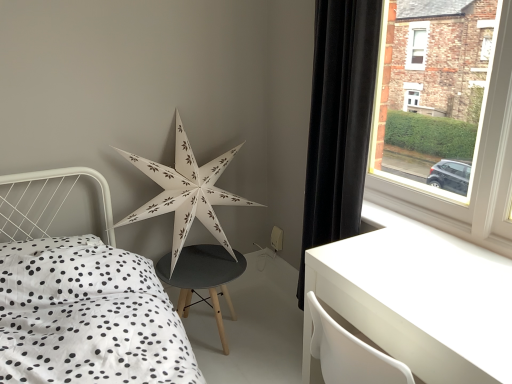
Question: Is black velvet curtain at right bigger than white glossy table at lower right?

Choices:
 (A) no
 (B) yes

Answer: (A)

Question: Are black velvet curtain at right and white glossy table at lower right beside each other?

Choices:
 (A) yes
 (B) no

Answer: (B)

Question: Is black velvet curtain at right oriented towards white glossy table at lower right?

Choices:
 (A) no
 (B) yes

Answer: (A)

Question: From a real-world perspective, is black velvet curtain at right positioned under white glossy table at lower right based on gravity?

Choices:
 (A) no
 (B) yes

Answer: (A)

Question: Is black velvet curtain at right positioned before white glossy table at lower right?

Choices:
 (A) yes
 (B) no

Answer: (B)

Question: Visually, is white glossy table at lower right positioned to the left or to the right of white paper star at center?

Choices:
 (A) left
 (B) right

Answer: (B)

Question: Is white glossy table at lower right wider or thinner than white paper star at center?

Choices:
 (A) wide
 (B) thin

Answer: (A)

Question: Is point (451, 309) positioned closer to the camera than point (210, 205)?

Choices:
 (A) closer
 (B) farther

Answer: (A)

Question: From a real-world perspective, relative to white paper star at center, is white glossy table at lower right vertically above or below?

Choices:
 (A) above
 (B) below

Answer: (B)

Question: Considering the positions of white glossy table at lower right and white smooth window sill at lower right in the image, is white glossy table at lower right bigger or smaller than white smooth window sill at lower right?

Choices:
 (A) big
 (B) small

Answer: (A)

Question: In the image, is white glossy table at lower right positioned in front of or behind white smooth window sill at lower right?

Choices:
 (A) behind
 (B) front

Answer: (B)

Question: Considering the positions of point (309, 369) and point (436, 205), is point (309, 369) closer or farther from the camera than point (436, 205)?

Choices:
 (A) closer
 (B) farther

Answer: (A)

Question: From the image's perspective, is white glossy table at lower right above or below white smooth window sill at lower right?

Choices:
 (A) below
 (B) above

Answer: (A)

Question: Based on their positions, is white paper star at center located to the left or right of white glossy table at lower right?

Choices:
 (A) right
 (B) left

Answer: (B)

Question: Considering the positions of white paper star at center and white glossy table at lower right in the image, is white paper star at center taller or shorter than white glossy table at lower right?

Choices:
 (A) tall
 (B) short

Answer: (A)